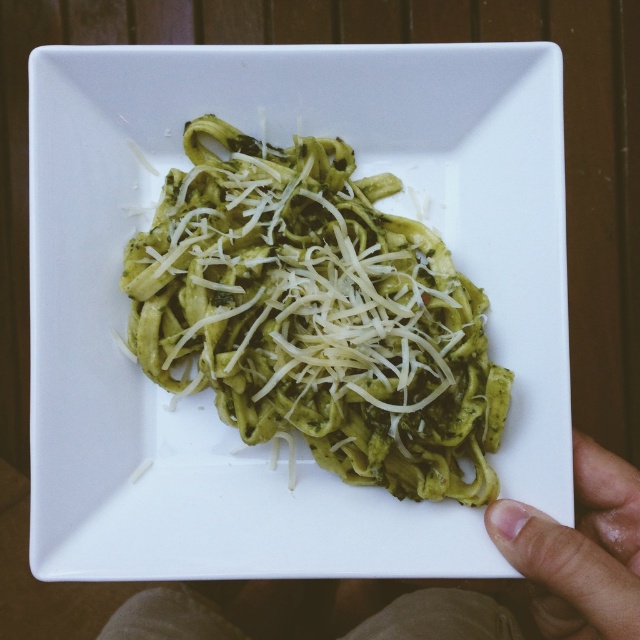
Is smooth skin hand at upper right above flesh-toned skin at lower right?

No, smooth skin hand at upper right is not above flesh-toned skin at lower right.

Can you confirm if smooth skin hand at upper right is shorter than flesh-toned skin at lower right?

Incorrect, smooth skin hand at upper right's height does not fall short of flesh-toned skin at lower right's.

Find the location of a particular element. smooth skin hand at upper right is located at coordinates (541, 568).

Find the location of a particular element. Image resolution: width=640 pixels, height=640 pixels. smooth skin hand at upper right is located at coordinates (541, 568).

Does green matte pasta at center have a larger size compared to smooth skin hand at upper right?

No.

Describe the element at coordinates (316, 316) in the screenshot. I see `green matte pasta at center` at that location.

Find the location of a particular element. The height and width of the screenshot is (640, 640). green matte pasta at center is located at coordinates (316, 316).

Is green matte pasta at center taller than flesh-toned skin at lower right?

Yes, green matte pasta at center is taller than flesh-toned skin at lower right.

Is green matte pasta at center thinner than flesh-toned skin at lower right?

No.

What do you see at coordinates (316, 316) in the screenshot? I see `green matte pasta at center` at bounding box center [316, 316].

This screenshot has width=640, height=640. I want to click on green matte pasta at center, so click(x=316, y=316).